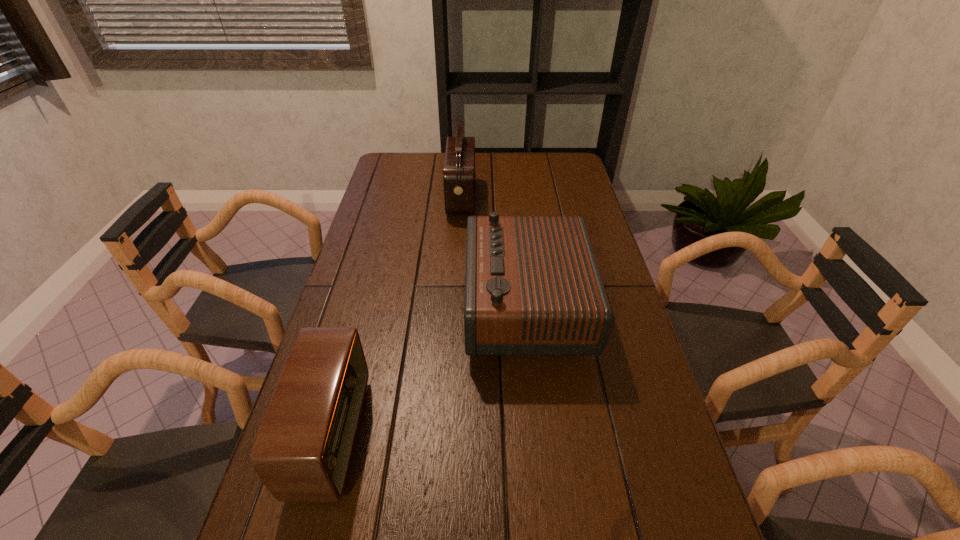
The height and width of the screenshot is (540, 960). What are the coordinates of `the farthest radio receiver` in the screenshot? It's located at (459, 177).

This screenshot has width=960, height=540. I want to click on the second nearest object, so pyautogui.click(x=532, y=284).

Image resolution: width=960 pixels, height=540 pixels. Identify the location of the nearest radio receiver. (302, 453).

Where is `the leftmost object`? This screenshot has width=960, height=540. the leftmost object is located at coordinates (302, 453).

Find the location of a particular element. vacant area situated 0.260m on the front panel of the farthest radio receiver is located at coordinates (546, 198).

Where is `vacant space situated 0.370m on the front panel of the second farthest object`? The image size is (960, 540). vacant space situated 0.370m on the front panel of the second farthest object is located at coordinates (333, 306).

This screenshot has height=540, width=960. I want to click on free space located 0.270m on the front panel of the second farthest object, so click(x=370, y=306).

Where is `vacant region located 0.190m on the front panel of the second farthest object`? vacant region located 0.190m on the front panel of the second farthest object is located at coordinates (398, 306).

Locate an element on the screen. The width and height of the screenshot is (960, 540). free space located 0.400m on the front-facing side of the leftmost object is located at coordinates (548, 436).

You are a GUI agent. You are given a task and a screenshot of the screen. Output one action in this format:
    pyautogui.click(x=<x>, y=<y>)
    Task: Click on the object located at the far edge
    Image resolution: width=960 pixels, height=540 pixels.
    Given the screenshot: What is the action you would take?
    pyautogui.click(x=459, y=177)